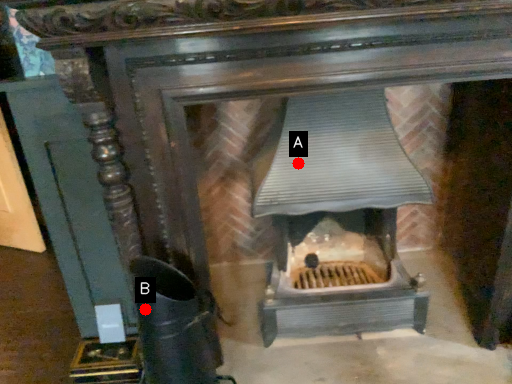
Question: Two points are circled on the image, labeled by A and B beside each circle. Which of the following is the farthest from the observer?

Choices:
 (A) A is further
 (B) B is further

Answer: (A)